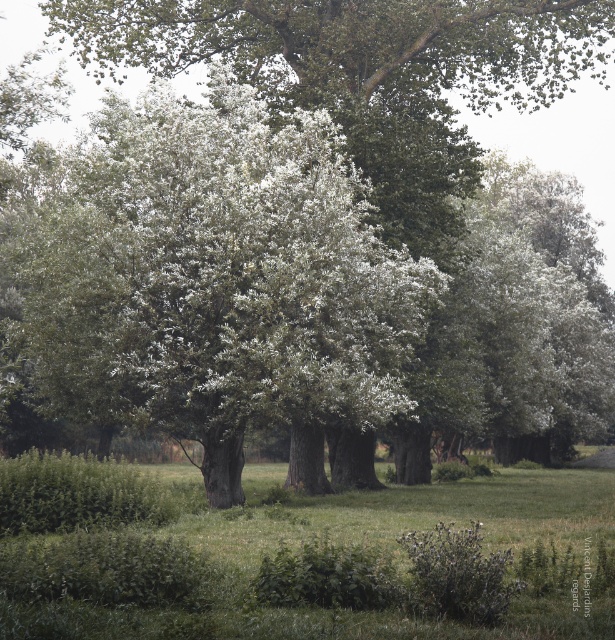
Question: Where is green matte tree at center located in relation to green grass at center in the image?

Choices:
 (A) below
 (B) above

Answer: (B)

Question: Which point is farther from the camera taking this photo?

Choices:
 (A) (333, 189)
 (B) (44, 488)

Answer: (A)

Question: Which point is farther to the camera?

Choices:
 (A) green matte tree at center
 (B) green grass at center
 (C) green leafy hedge at lower left

Answer: (A)

Question: Where is green matte tree at center located in relation to green leafy hedge at lower left in the image?

Choices:
 (A) above
 (B) below

Answer: (A)

Question: Is green grass at center positioned in front of green leafy hedge at lower left?

Choices:
 (A) no
 (B) yes

Answer: (B)

Question: Which point is closer to the camera?

Choices:
 (A) (22, 376)
 (B) (442, 618)

Answer: (B)